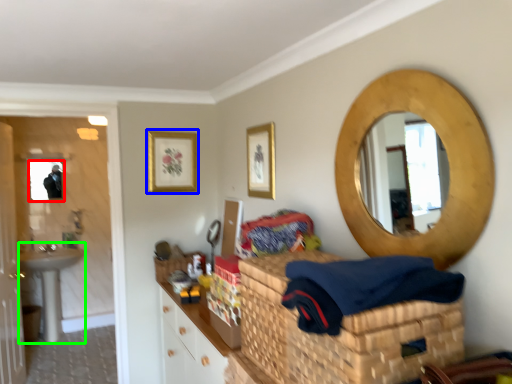
Question: Which object is the farthest from mirror (highlighted by a red box)? Choose among these: picture frame (highlighted by a blue box) or sink (highlighted by a green box).

Choices:
 (A) picture frame
 (B) sink

Answer: (A)